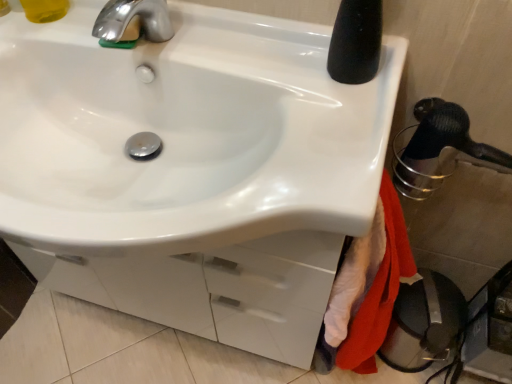
Question: Is black rubber shower head at right behind shiny metallic faucet at upper left?

Choices:
 (A) no
 (B) yes

Answer: (A)

Question: Can you confirm if black rubber shower head at right is thinner than shiny metallic faucet at upper left?

Choices:
 (A) no
 (B) yes

Answer: (B)

Question: Is black rubber shower head at right taller than shiny metallic faucet at upper left?

Choices:
 (A) no
 (B) yes

Answer: (B)

Question: Is black rubber shower head at right turned away from shiny metallic faucet at upper left?

Choices:
 (A) yes
 (B) no

Answer: (B)

Question: Does black rubber shower head at right come in front of shiny metallic faucet at upper left?

Choices:
 (A) yes
 (B) no

Answer: (A)

Question: From the image's perspective, is black rubber shower head at right on top of shiny metallic faucet at upper left?

Choices:
 (A) yes
 (B) no

Answer: (B)

Question: Is white glossy sink at center taller than shiny metallic faucet at upper left?

Choices:
 (A) yes
 (B) no

Answer: (A)

Question: Is white glossy sink at center not near shiny metallic faucet at upper left?

Choices:
 (A) no
 (B) yes

Answer: (A)

Question: Does white glossy sink at center have a lesser width compared to shiny metallic faucet at upper left?

Choices:
 (A) yes
 (B) no

Answer: (B)

Question: Is white glossy sink at center directly adjacent to shiny metallic faucet at upper left?

Choices:
 (A) no
 (B) yes

Answer: (A)

Question: Considering the relative sizes of white glossy sink at center and shiny metallic faucet at upper left in the image provided, is white glossy sink at center wider than shiny metallic faucet at upper left?

Choices:
 (A) no
 (B) yes

Answer: (B)

Question: From the image's perspective, does white glossy sink at center appear higher than shiny metallic faucet at upper left?

Choices:
 (A) no
 (B) yes

Answer: (A)

Question: Is red cotton bath towel at lower right touching white glossy sink at center?

Choices:
 (A) no
 (B) yes

Answer: (A)